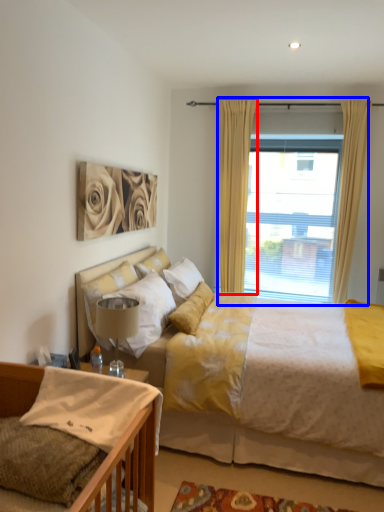
Question: Among these objects, which one is nearest to the camera, curtain (highlighted by a red box) or window (highlighted by a blue box)?

Choices:
 (A) curtain
 (B) window

Answer: (A)